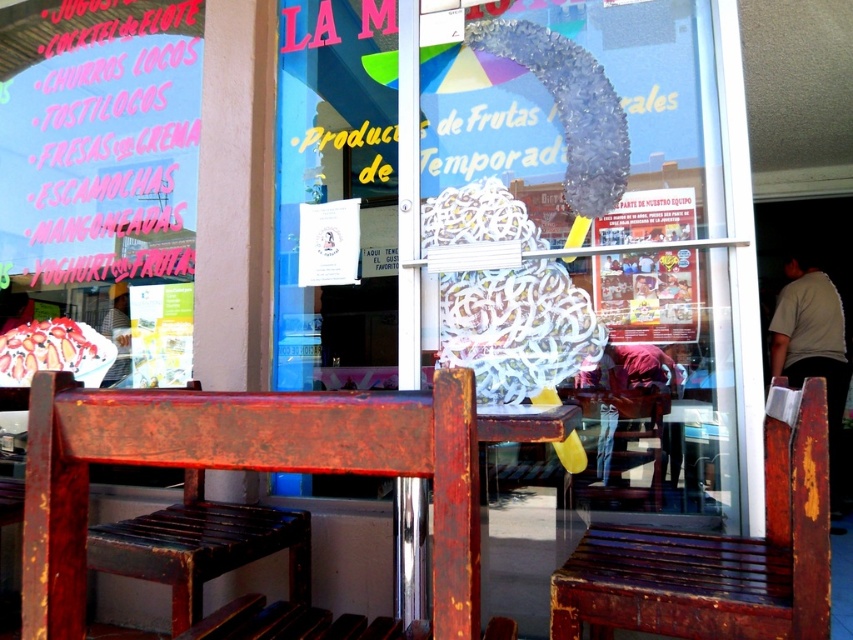
You are standing in front of the LA M shop window and see the rusty wood chair at center and the rusty wooden chair at lower center. Which chair is positioned to the left of the other?

The rusty wood chair at center is to the left of the rusty wooden chair at lower center.

You are standing in front of the shop LA M and want to sit down on the rusty wood chair at center. Where exactly should you go to find it?

The rusty wood chair at center is located at the coordinates point (244,468).

You are standing in front of the shop window of LA M. There are two points marked on the window. The first point is at coordinates point (62, 596) and the second is at point (787, 531). Which point is closer to you?

Point (62, 596) is closer to the viewer than point (787, 531).